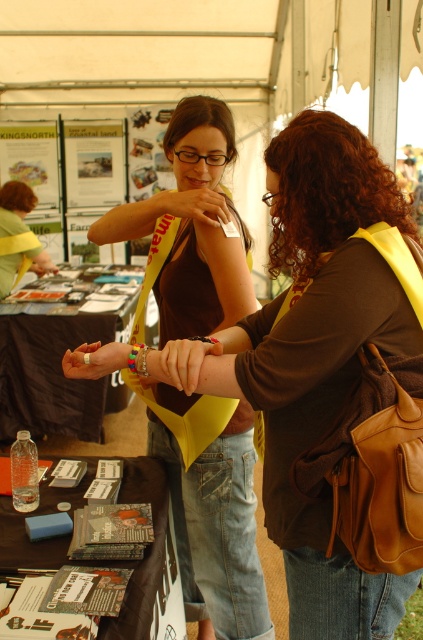
You are standing at the entrance of the tent and want to move towards the two points marked in the scene. Which point, point (x=365, y=276) or point (x=222, y=136), would you reach first?

Point (x=365, y=276) is closer to the viewer than point (x=222, y=136), so you would reach point (x=365, y=276) first.

In the scene shown: You are organizing an event and need to place both the brown leather purse at center and the matte plastic wristband at center into a single storage compartment. Which item should you place first to ensure both fit properly?

You should place the brown leather purse at center first because it occupies less space than the matte plastic wristband at center, allowing the larger wristband to fit around it.